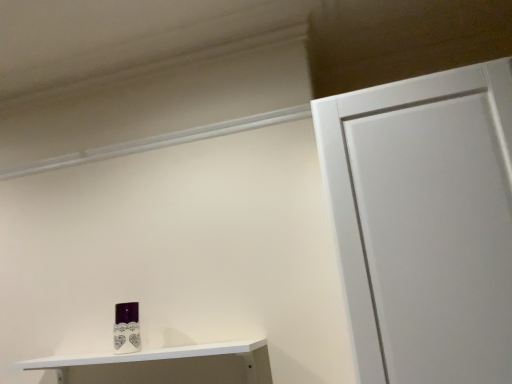
Image resolution: width=512 pixels, height=384 pixels. What are the coordinates of `white glossy shelf at lower left` in the screenshot? It's located at (165, 365).

The image size is (512, 384). Describe the element at coordinates (165, 365) in the screenshot. I see `white glossy shelf at lower left` at that location.

This screenshot has width=512, height=384. What do you see at coordinates (126, 328) in the screenshot? I see `purple glossy toiletry at lower left` at bounding box center [126, 328].

In order to click on purple glossy toiletry at lower left in this screenshot , I will do `click(126, 328)`.

Identify the location of white glossy shelf at lower left. This screenshot has height=384, width=512. (165, 365).

Can you confirm if white glossy shelf at lower left is positioned to the right of purple glossy toiletry at lower left?

Indeed, white glossy shelf at lower left is positioned on the right side of purple glossy toiletry at lower left.

Between white glossy shelf at lower left and purple glossy toiletry at lower left, which one is positioned behind?

purple glossy toiletry at lower left is behind.

From the picture: Which point is more forward, (x=179, y=373) or (x=118, y=326)?

The point (x=179, y=373) is more forward.

From the image's perspective, which is below, white glossy shelf at lower left or purple glossy toiletry at lower left?

white glossy shelf at lower left.

From a real-world perspective, which object rests below the other?

white glossy shelf at lower left, from a real-world perspective.

Is white glossy shelf at lower left thinner than purple glossy toiletry at lower left?

Incorrect, the width of white glossy shelf at lower left is not less than that of purple glossy toiletry at lower left.

Considering the sizes of white glossy shelf at lower left and purple glossy toiletry at lower left in the image, is white glossy shelf at lower left taller or shorter than purple glossy toiletry at lower left?

Considering their sizes, white glossy shelf at lower left has less height than purple glossy toiletry at lower left.

Considering the sizes of objects white glossy shelf at lower left and purple glossy toiletry at lower left in the image provided, who is smaller, white glossy shelf at lower left or purple glossy toiletry at lower left?

purple glossy toiletry at lower left is smaller.

Would you say white glossy shelf at lower left is outside purple glossy toiletry at lower left?

Yes, white glossy shelf at lower left is outside of purple glossy toiletry at lower left.

Consider the image. Is white glossy shelf at lower left positioned far away from purple glossy toiletry at lower left?

No, white glossy shelf at lower left is in close proximity to purple glossy toiletry at lower left.

Is white glossy shelf at lower left oriented away from purple glossy toiletry at lower left?

white glossy shelf at lower left does not have its back to purple glossy toiletry at lower left.

Consider the image. What's the angular difference between white glossy shelf at lower left and purple glossy toiletry at lower left's facing directions?

1.26 degrees.

You are a GUI agent. You are given a task and a screenshot of the screen. Output one action in this format:
    pyautogui.click(x=<x>, y=<y>)
    Task: Click on the toiletry that appears on the left of white glossy shelf at lower left
    This screenshot has height=384, width=512.
    Given the screenshot: What is the action you would take?
    pyautogui.click(x=126, y=328)

Does purple glossy toiletry at lower left appear on the left side of white glossy shelf at lower left?

Yes.

Is purple glossy toiletry at lower left in front of or behind white glossy shelf at lower left in the image?

Result: In the image, purple glossy toiletry at lower left appears behind white glossy shelf at lower left.

Does point (123, 313) lie behind point (58, 363)?

Yes.

From the image's perspective, between purple glossy toiletry at lower left and white glossy shelf at lower left, which one is located above?

purple glossy toiletry at lower left is shown above in the image.

From a real-world perspective, is purple glossy toiletry at lower left positioned under white glossy shelf at lower left based on gravity?

Actually, purple glossy toiletry at lower left is physically above white glossy shelf at lower left in the real world.

Can you confirm if purple glossy toiletry at lower left is wider than white glossy shelf at lower left?

Incorrect, the width of purple glossy toiletry at lower left does not surpass that of white glossy shelf at lower left.

Between purple glossy toiletry at lower left and white glossy shelf at lower left, which one has less height?

white glossy shelf at lower left.

Which of these two, purple glossy toiletry at lower left or white glossy shelf at lower left, is bigger?

white glossy shelf at lower left.

Does purple glossy toiletry at lower left contain white glossy shelf at lower left?

Definitely not — white glossy shelf at lower left is not inside purple glossy toiletry at lower left.

Is purple glossy toiletry at lower left directly adjacent to white glossy shelf at lower left?

They are not placed beside each other.

Is purple glossy toiletry at lower left facing towards white glossy shelf at lower left?

No, purple glossy toiletry at lower left is not oriented towards white glossy shelf at lower left.

Can you tell me how much purple glossy toiletry at lower left and white glossy shelf at lower left differ in facing direction?

They differ by 1.26 degrees in their facing directions.

How far apart are purple glossy toiletry at lower left and white glossy shelf at lower left?

6.17 inches.

Where is `shelf below the purple glossy toiletry at lower left (from the image's perspective)`? The height and width of the screenshot is (384, 512). shelf below the purple glossy toiletry at lower left (from the image's perspective) is located at coordinates (165, 365).

Find the location of `shelf that is below the purple glossy toiletry at lower left (from the image's perspective)`. shelf that is below the purple glossy toiletry at lower left (from the image's perspective) is located at coordinates (165, 365).

Locate an element on the screen. This screenshot has width=512, height=384. toiletry behind the white glossy shelf at lower left is located at coordinates (126, 328).